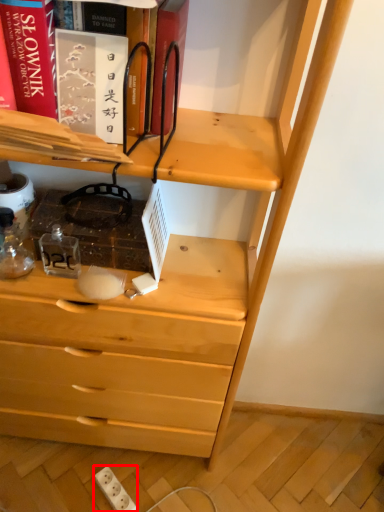
Question: From the image's perspective, what is the correct spatial positioning of electric outlet (annotated by the red box) in reference to book?

Choices:
 (A) below
 (B) above

Answer: (A)